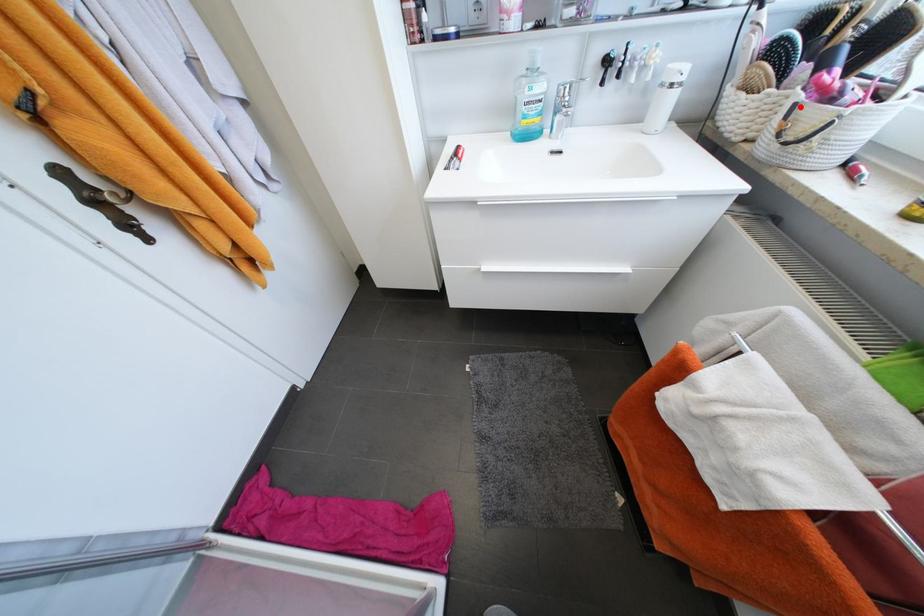
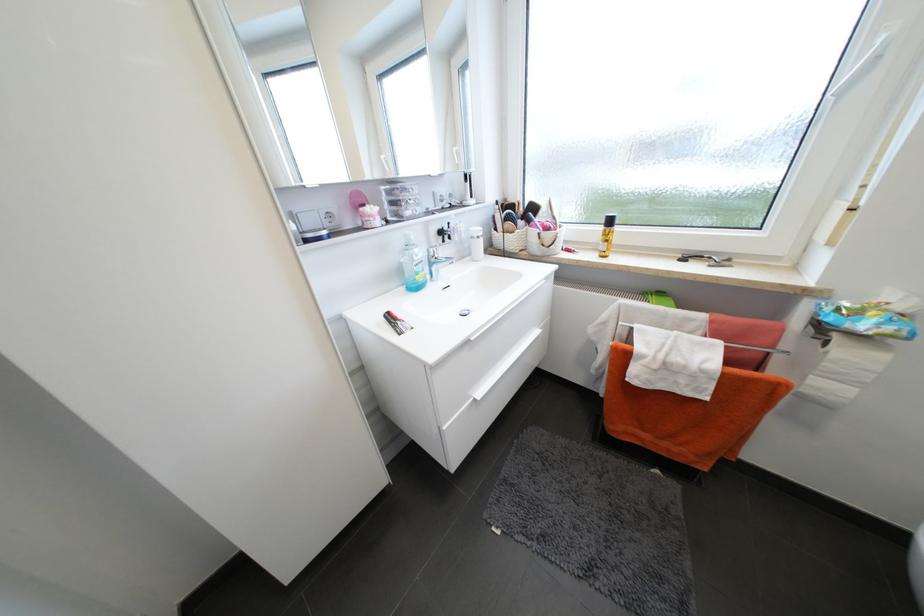
Find the pixel in the second image that matches the highlighted location in the first image.

(544, 235)